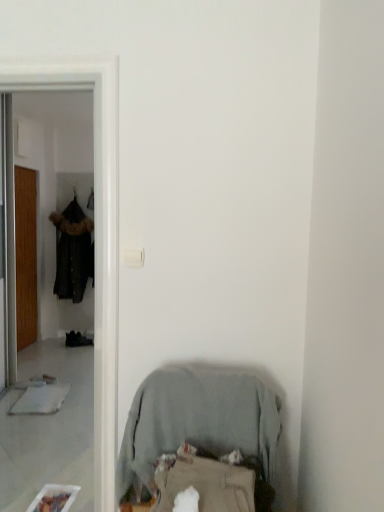
Question: Is transparent plastic screen door at left smaller than dark brown fur-trimmed coat at left?

Choices:
 (A) yes
 (B) no

Answer: (A)

Question: Considering the relative sizes of transparent plastic screen door at left and dark brown fur-trimmed coat at left in the image provided, is transparent plastic screen door at left shorter than dark brown fur-trimmed coat at left?

Choices:
 (A) yes
 (B) no

Answer: (B)

Question: Is dark brown fur-trimmed coat at left at the back of transparent plastic screen door at left?

Choices:
 (A) yes
 (B) no

Answer: (B)

Question: From the image's perspective, would you say transparent plastic screen door at left is shown under dark brown fur-trimmed coat at left?

Choices:
 (A) no
 (B) yes

Answer: (B)

Question: Is transparent plastic screen door at left bigger than dark brown fur-trimmed coat at left?

Choices:
 (A) no
 (B) yes

Answer: (A)

Question: Is transparent plastic screen door at left located outside dark brown fur-trimmed coat at left?

Choices:
 (A) no
 (B) yes

Answer: (B)

Question: Is light gray fabric chair at lower center looking in the opposite direction of wooden door at left?

Choices:
 (A) no
 (B) yes

Answer: (A)

Question: Can you confirm if light gray fabric chair at lower center is smaller than wooden door at left?

Choices:
 (A) no
 (B) yes

Answer: (B)

Question: Is light gray fabric chair at lower center closer to camera compared to wooden door at left?

Choices:
 (A) yes
 (B) no

Answer: (A)

Question: Is there a large distance between light gray fabric chair at lower center and wooden door at left?

Choices:
 (A) yes
 (B) no

Answer: (A)

Question: Considering the relative positions of light gray fabric chair at lower center and wooden door at left in the image provided, is light gray fabric chair at lower center to the right of wooden door at left from the viewer's perspective?

Choices:
 (A) no
 (B) yes

Answer: (B)

Question: Does light gray fabric chair at lower center have a lesser width compared to wooden door at left?

Choices:
 (A) no
 (B) yes

Answer: (A)

Question: Is light gray fabric chair at lower center to the left of dark brown fur-trimmed coat at left from the viewer's perspective?

Choices:
 (A) no
 (B) yes

Answer: (A)